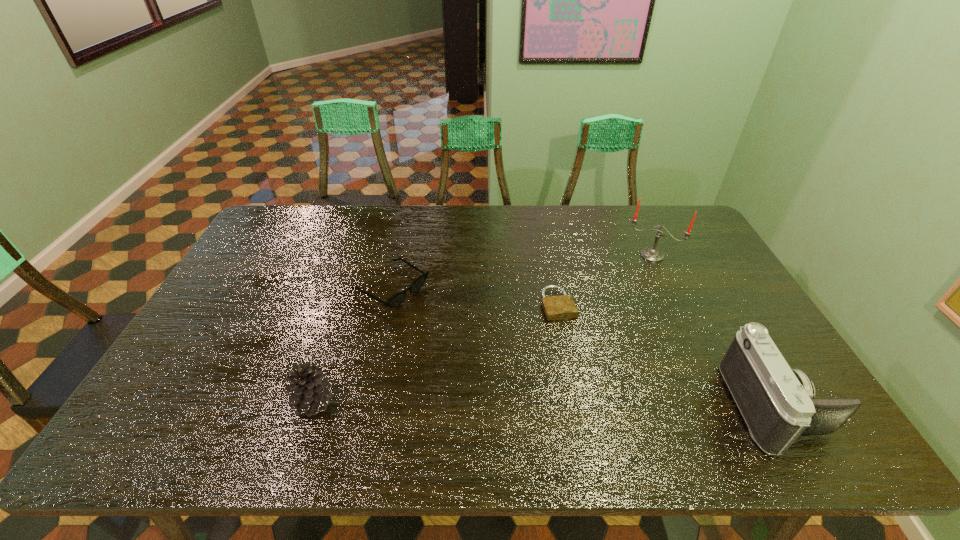
You are a GUI agent. You are given a task and a screenshot of the screen. Output one action in this format:
    pyautogui.click(x=<x>, y=<y>)
    Task: Click on the vacant space on the desktop that is between the pinecone and the camera and is positioned on the front-facing side of the candle
    
    Given the screenshot: What is the action you would take?
    pyautogui.click(x=610, y=405)

You are a GUI agent. You are given a task and a screenshot of the screen. Output one action in this format:
    pyautogui.click(x=<x>, y=<y>)
    Task: Click on the vacant space on the desktop that is between the pinecone and the second tallest object and is positioned on the keyhole side of the shortest object
    
    Given the screenshot: What is the action you would take?
    pyautogui.click(x=599, y=405)

This screenshot has width=960, height=540. Identify the location of vacant space on the desktop that is between the third shortest object and the second tallest object and is positioned on the front-facing side of the fourth tallest object. (589, 404).